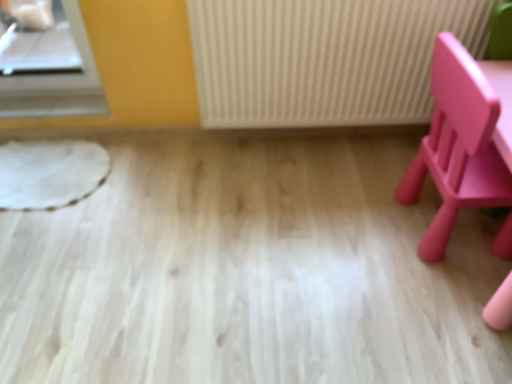
Locate an element on the screen. free region under white textured radiator at center (from a real-world perspective) is located at coordinates coord(324,140).